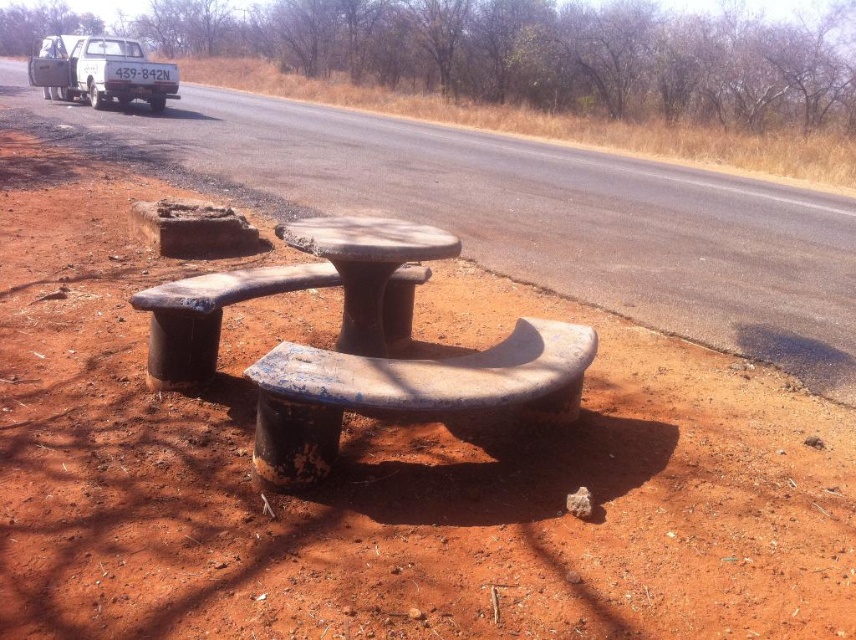
You are a photographer setting up a shot of the blue painted wood bench at center and the white matte truck at upper left. Which object should you place closer to the camera to ensure both are in focus without adjusting the aperture?

The blue painted wood bench at center is shorter than the white matte truck at upper left, so you should place the blue painted wood bench at center closer to the camera to ensure both are in focus without adjusting the aperture.

You are a painter who needs to decide which bench to paint first. Both the blue painted wood bench at center and the rusty wood bench at center are in need of touchup. Considering their heights, which bench should you paint first if you prefer starting with the shorter one?

The blue painted wood bench at center is shorter than the rusty wood bench at center, so you should paint the blue painted wood bench at center first.